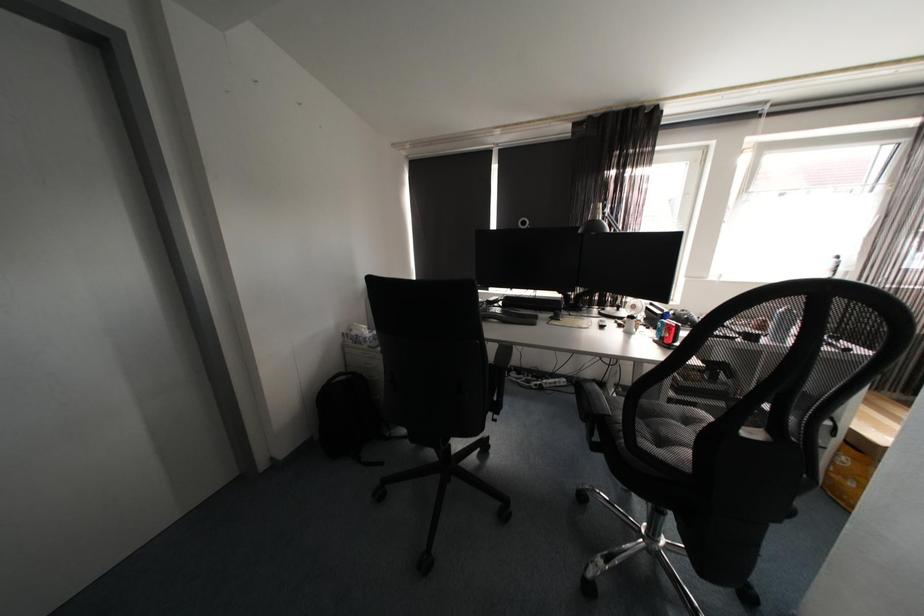
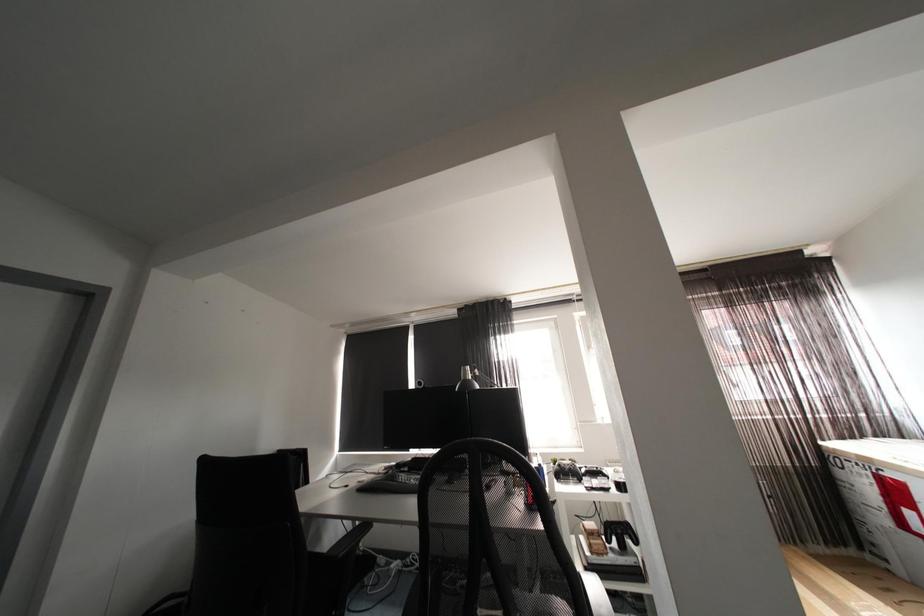
Question: The first image is from the beginning of the video and the second image is from the end. How did the camera likely rotate when shooting the video?

Choices:
 (A) Left
 (B) Right
 (C) Up
 (D) Down

Answer: (C)